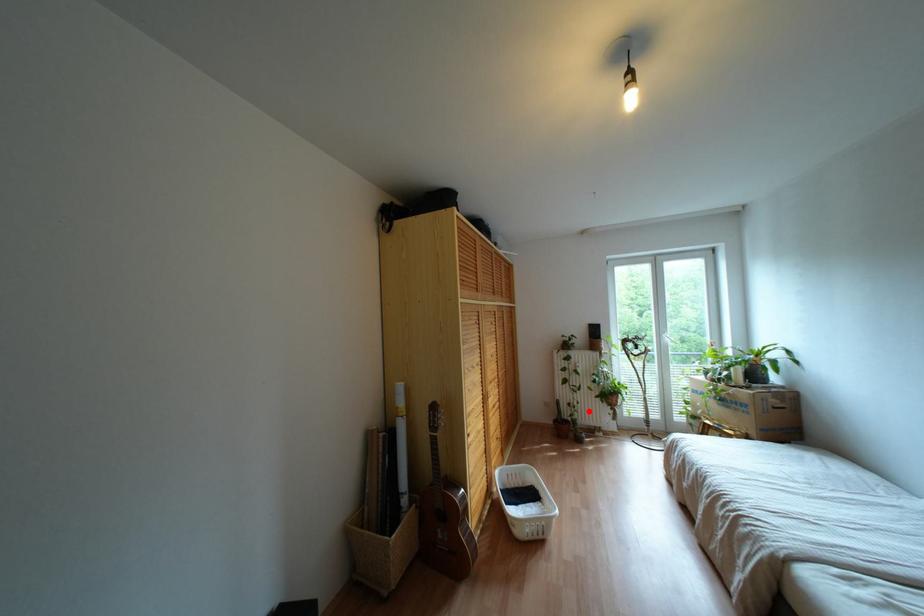
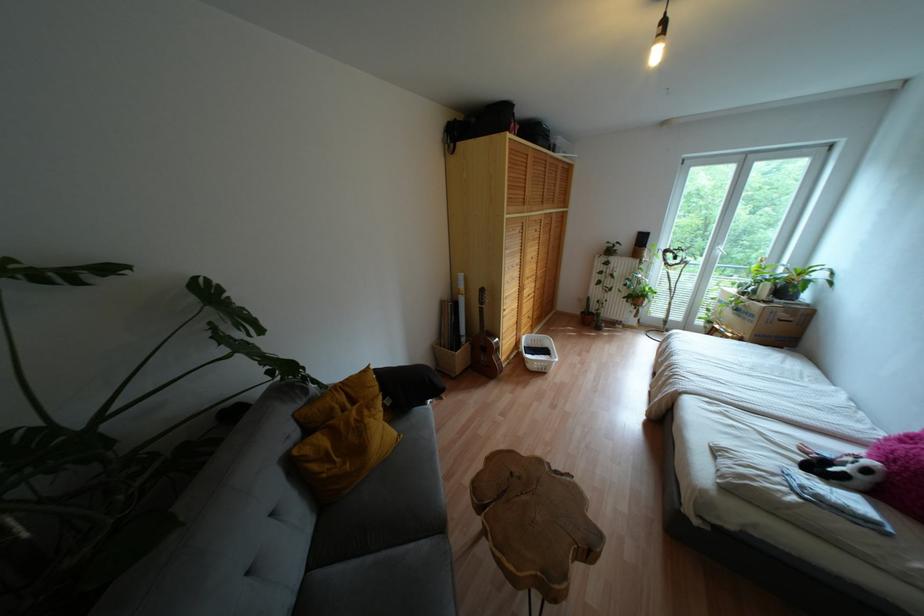
Question: I am providing you with two images of the same scene from different viewpoints. In image1, a red point is highlighted. Considering the same 3D point in image2, which of the following is correct?

Choices:
 (A) It is closer
 (B) It is farther

Answer: (A)